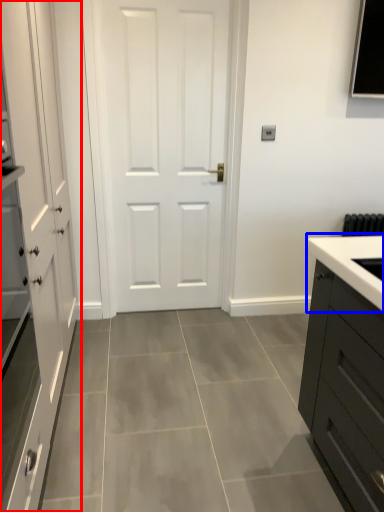
Question: Which of the following is the farthest to the observer, cabinetry (highlighted by a red box) or sink (highlighted by a blue box)?

Choices:
 (A) cabinetry
 (B) sink

Answer: (B)